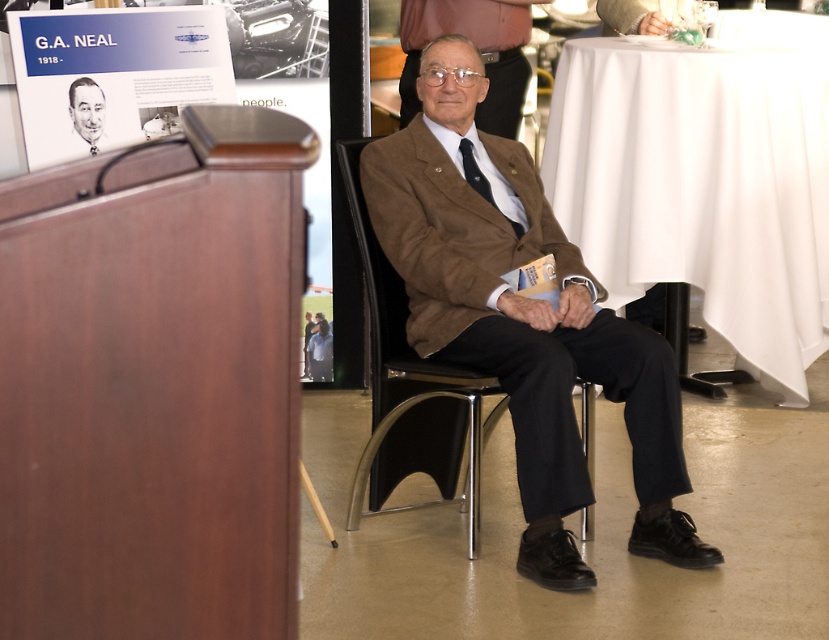
Can you confirm if black plastic chair at center is thinner than matte black portrait at upper left?

In fact, black plastic chair at center might be wider than matte black portrait at upper left.

Who is more distant from viewer, [430,408] or [93,144]?

The point [430,408] is more distant.

What are the coordinates of `black plastic chair at center` in the screenshot? It's located at (410, 387).

Identify the location of black plastic chair at center. (410, 387).

Who is positioned more to the right, white cloth at right or matte black portrait at upper left?

Positioned to the right is white cloth at right.

What do you see at coordinates (703, 180) in the screenshot?
I see `white cloth at right` at bounding box center [703, 180].

Where is `white cloth at right`? The height and width of the screenshot is (640, 829). white cloth at right is located at coordinates (703, 180).

Can you confirm if white cloth at right is taller than brown woolen suit at center?

In fact, white cloth at right may be shorter than brown woolen suit at center.

Which of these two, white cloth at right or brown woolen suit at center, stands taller?

With more height is brown woolen suit at center.

Where is `white cloth at right`? white cloth at right is located at coordinates (703, 180).